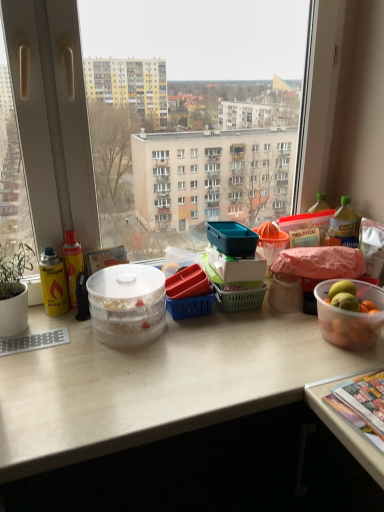
In order to click on free space in front of transparent plastic bowl at center, the second bowl from the right in this screenshot , I will do `click(110, 366)`.